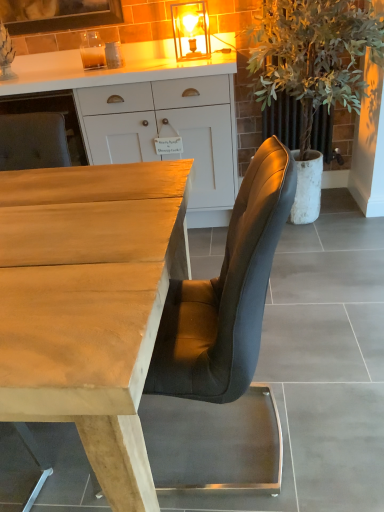
Question: From the image's perspective, relative to light brown wood desk at center, is white wood cabinet at upper center above or below?

Choices:
 (A) below
 (B) above

Answer: (B)

Question: In the image, is white wood cabinet at upper center on the left side or the right side of light brown wood desk at center?

Choices:
 (A) right
 (B) left

Answer: (A)

Question: Which object is the farthest from the white wood cabinet at upper center?

Choices:
 (A) light brown wood desk at center
 (B) matte glass lampshade at upper center
 (C) green leafy plant at right

Answer: (A)

Question: Estimate the real-world distances between objects in this image. Which object is farther from the matte glass lampshade at upper center?

Choices:
 (A) white wood cabinet at upper center
 (B) green leafy plant at right
 (C) light brown wood desk at center

Answer: (C)